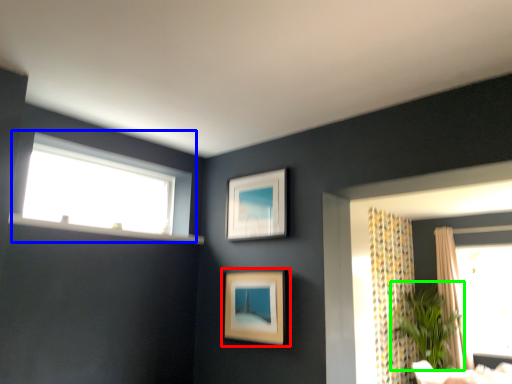
Question: Which object is positioned closest to picture frame (highlighted by a red box)? Select from window (highlighted by a blue box) and plant (highlighted by a green box).

Choices:
 (A) window
 (B) plant

Answer: (A)